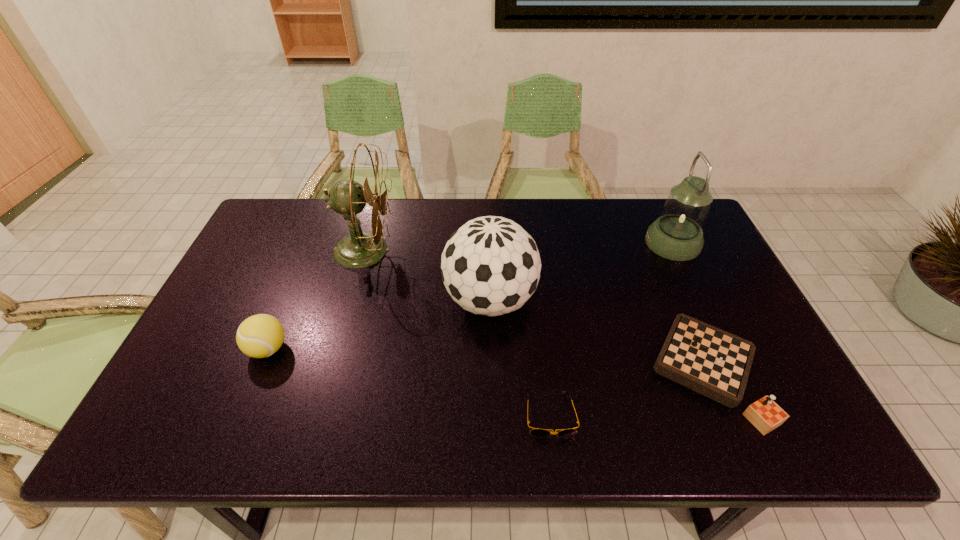
Find the location of a particular element. vacant space located on the back of the tennis ball is located at coordinates (291, 293).

Find the location of a particular element. Image resolution: width=960 pixels, height=540 pixels. free space located on the back of the fifth tallest object is located at coordinates (664, 272).

Find the location of a particular element. fan that is at the far edge is located at coordinates (359, 249).

Locate an element on the screen. This screenshot has height=540, width=960. lantern present at the far edge is located at coordinates (677, 234).

Image resolution: width=960 pixels, height=540 pixels. What are the coordinates of `chessboard present at the near edge` in the screenshot? It's located at (710, 361).

Find the location of `sunglasses situated at the near edge`. sunglasses situated at the near edge is located at coordinates (536, 432).

Locate an element on the screen. object that is at the left edge is located at coordinates (259, 336).

Locate an element on the screen. The width and height of the screenshot is (960, 540). lantern at the right edge is located at coordinates click(677, 234).

I want to click on chessboard at the right edge, so click(x=710, y=361).

Find the location of a particular element. This screenshot has width=960, height=540. object situated at the far right corner is located at coordinates (677, 234).